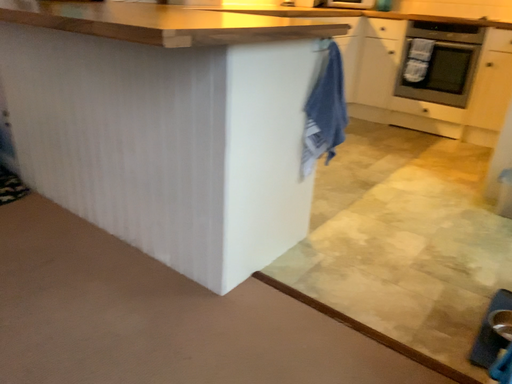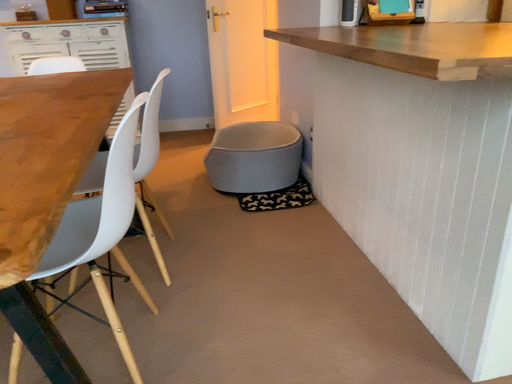
Question: Which way did the camera rotate in the video?

Choices:
 (A) rotated right
 (B) rotated left

Answer: (B)